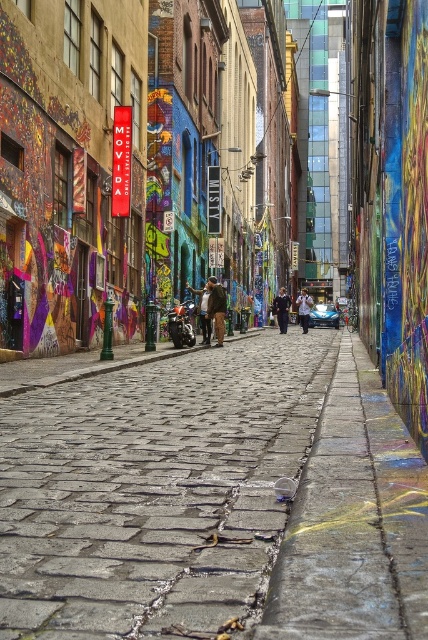
You are a delivery person in the alleyway and need to place a package on the ground. The package must be placed exactly at the coordinates where the brown leather jacket at center is located. What are the coordinates where you should place the package?

The coordinates for the brown leather jacket at center are at point (216, 308), so you should place the package at those exact coordinates.